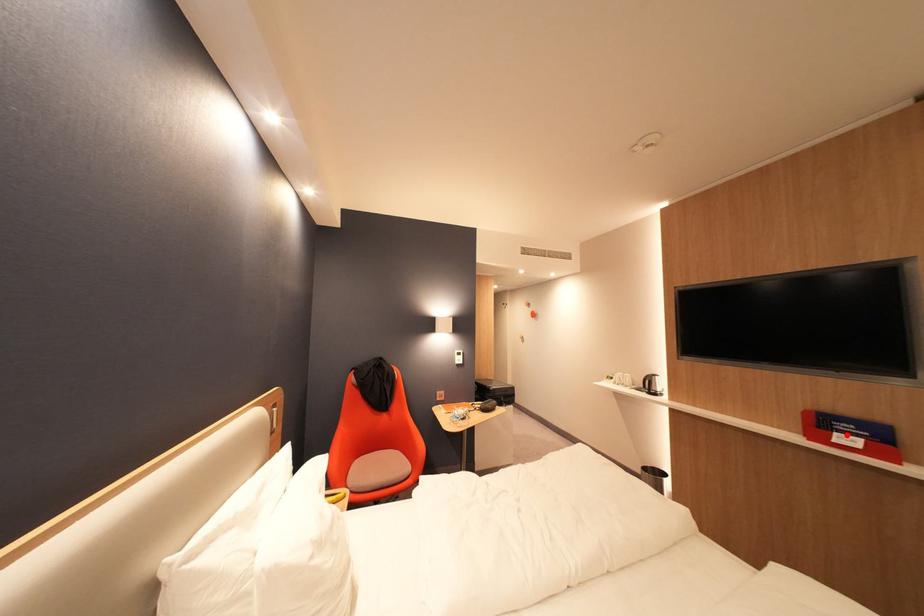
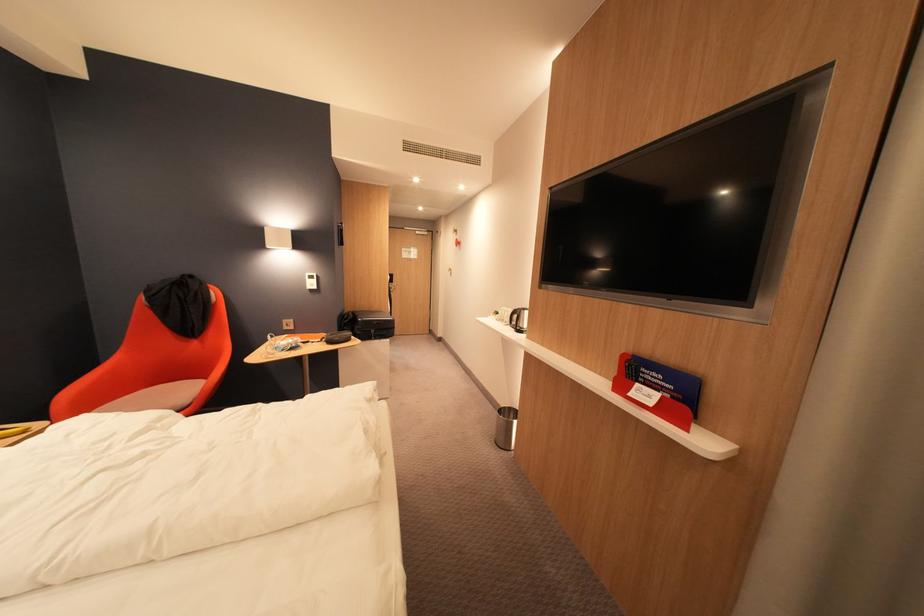
Where in the second image is the point corresponding to the highlighted location from the first image?

(648, 386)